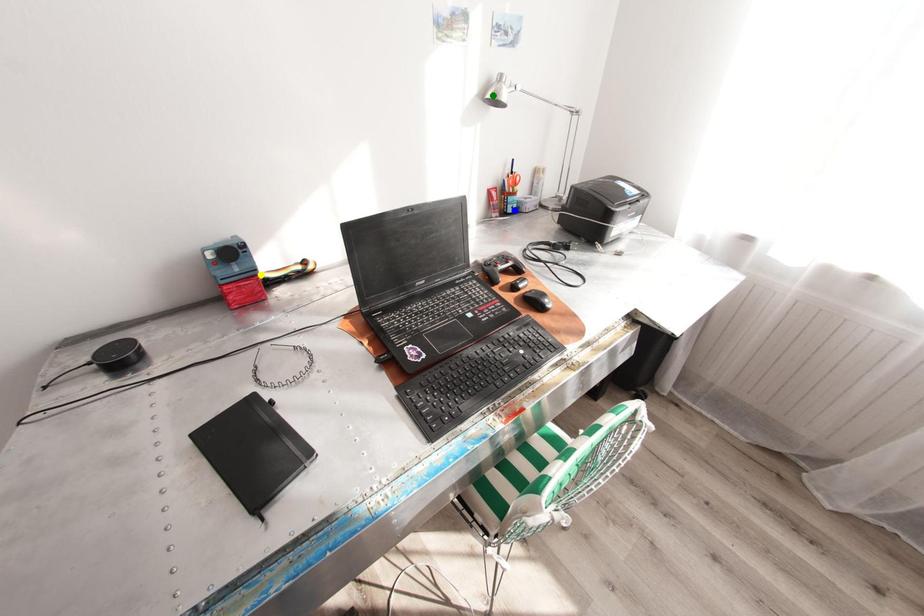
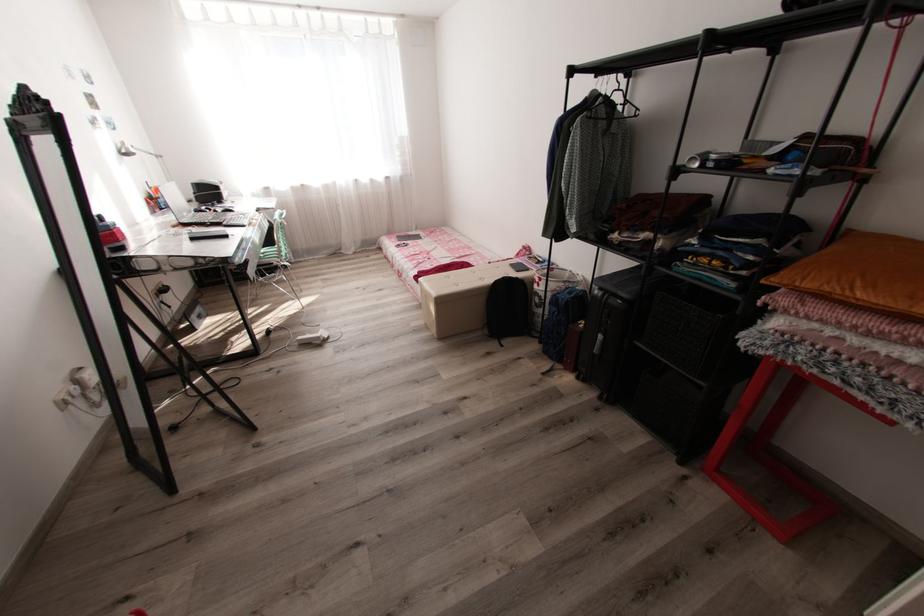
I am providing you with two images of the same scene from different viewpoints. Three points are marked in image1. Which point corresponds to a part or object that is occluded in image2?In image1, three points are marked. Which of them correspond to a part or object that is occluded in image2?Among the three points shown in image1, which one corresponds to a part or object that is no longer visible due to occlusion in image2?

Invisible in image2: yellow point.